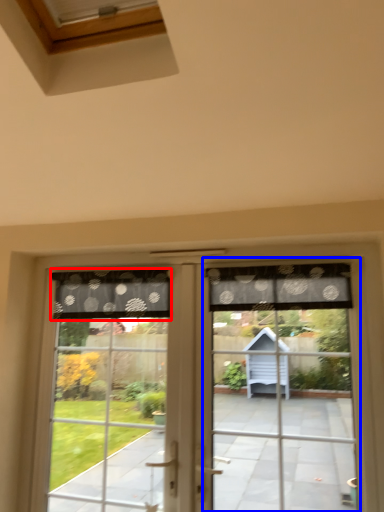
Question: Which object is further to the camera taking this photo, curtain (highlighted by a red box) or screen door (highlighted by a blue box)?

Choices:
 (A) curtain
 (B) screen door

Answer: (A)